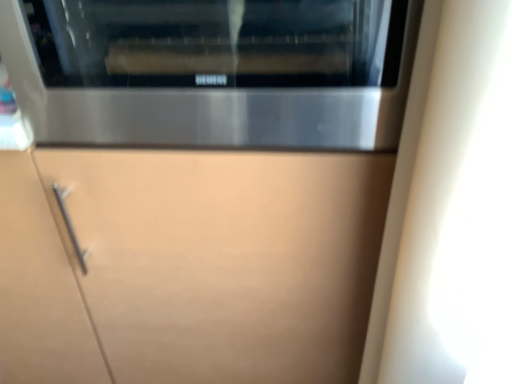
Locate an element on the screen. stainless steel microwave at upper center is located at coordinates (212, 71).

Describe the element at coordinates (212, 71) in the screenshot. I see `stainless steel microwave at upper center` at that location.

Find the location of a particular element. Image resolution: width=512 pixels, height=384 pixels. stainless steel microwave at upper center is located at coordinates pos(212,71).